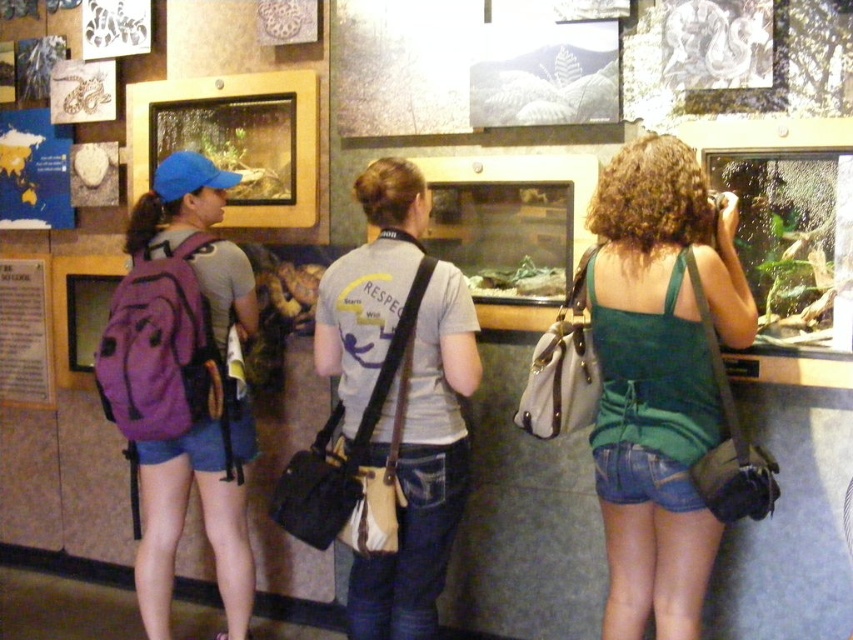
Question: Which point is closer to the camera?

Choices:
 (A) gray cotton t-shirt at center
 (B) green fabric tank top at center
 (C) purple fabric backpack at left

Answer: (B)

Question: Can you confirm if green fabric tank top at center is positioned below gray cotton t-shirt at center?

Choices:
 (A) no
 (B) yes

Answer: (A)

Question: Is green fabric tank top at center wider than gray cotton t-shirt at center?

Choices:
 (A) no
 (B) yes

Answer: (A)

Question: Which of the following is the farthest from the observer?

Choices:
 (A) green fabric tank top at center
 (B) gray cotton t-shirt at center
 (C) purple fabric backpack at left

Answer: (C)

Question: Is green fabric tank top at center below gray cotton t-shirt at center?

Choices:
 (A) yes
 (B) no

Answer: (B)

Question: Estimate the real-world distances between objects in this image. Which object is closer to the purple fabric backpack at left?

Choices:
 (A) green fabric tank top at center
 (B) gray cotton t-shirt at center

Answer: (B)